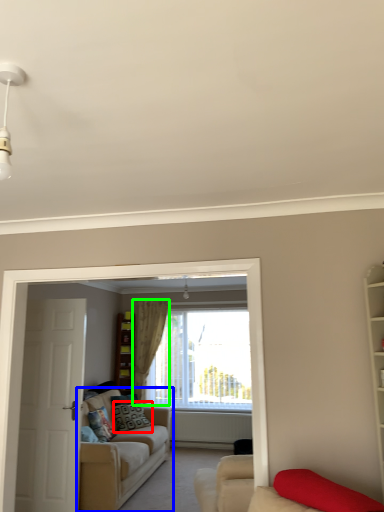
Question: Considering the real-world distances, which object is closest to pillow (highlighted by a red box)? studio couch (highlighted by a blue box) or curtain (highlighted by a green box).

Choices:
 (A) studio couch
 (B) curtain

Answer: (A)